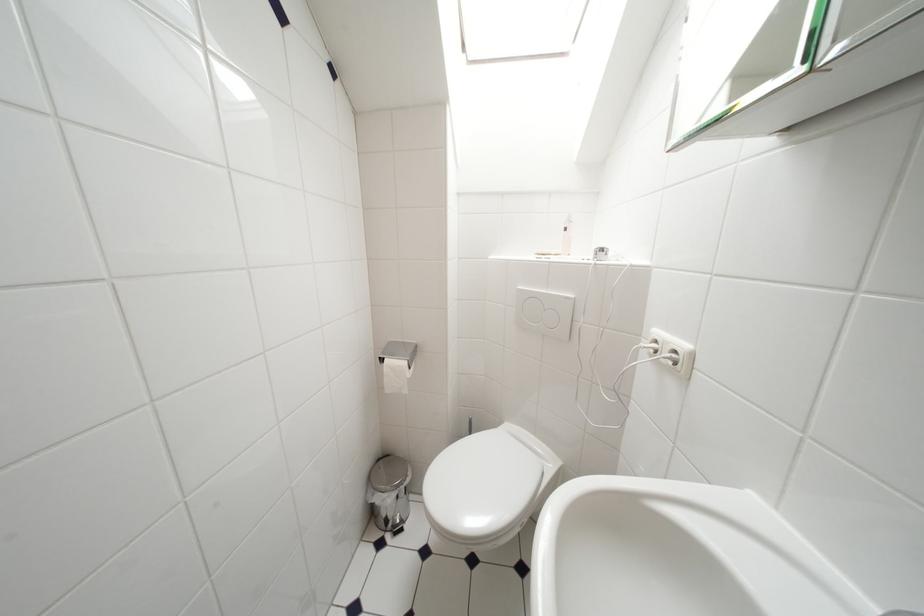
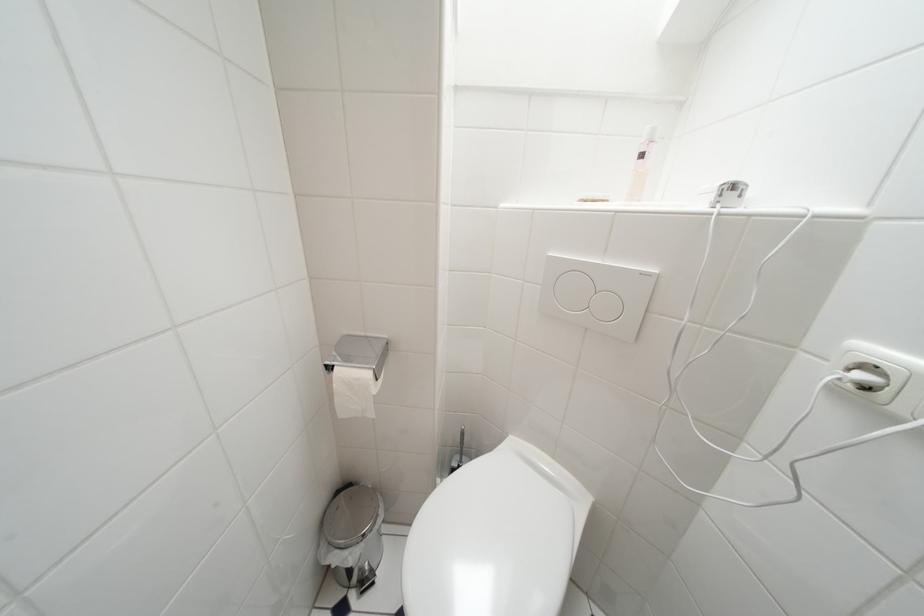
Question: The images are taken continuously from a first-person perspective. In which direction are you moving?

Choices:
 (A) Left
 (B) Right
 (C) Forward
 (D) Backward

Answer: (C)